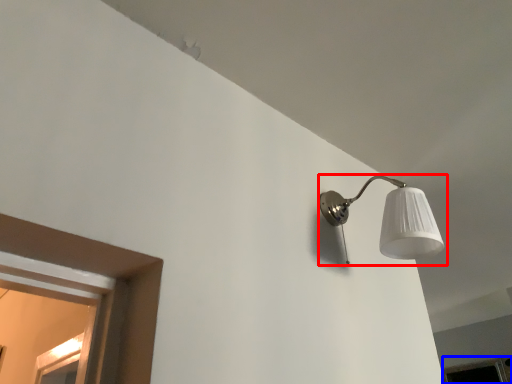
Question: Which object appears closest to the camera in this image, lamp (highlighted by a red box) or window (highlighted by a blue box)?

Choices:
 (A) lamp
 (B) window

Answer: (A)